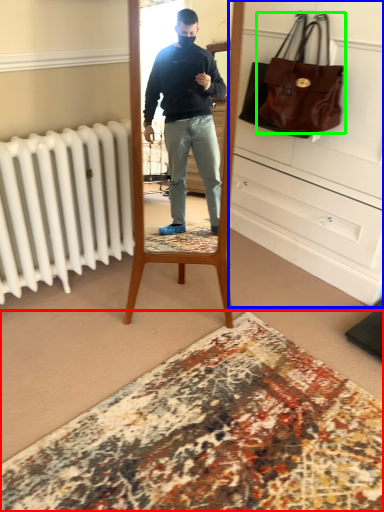
Question: Estimate the real-world distances between objects in this image. Which object is closer to plain (highlighted by a red box), dresser (highlighted by a blue box) or handbag (highlighted by a green box)?

Choices:
 (A) dresser
 (B) handbag

Answer: (A)